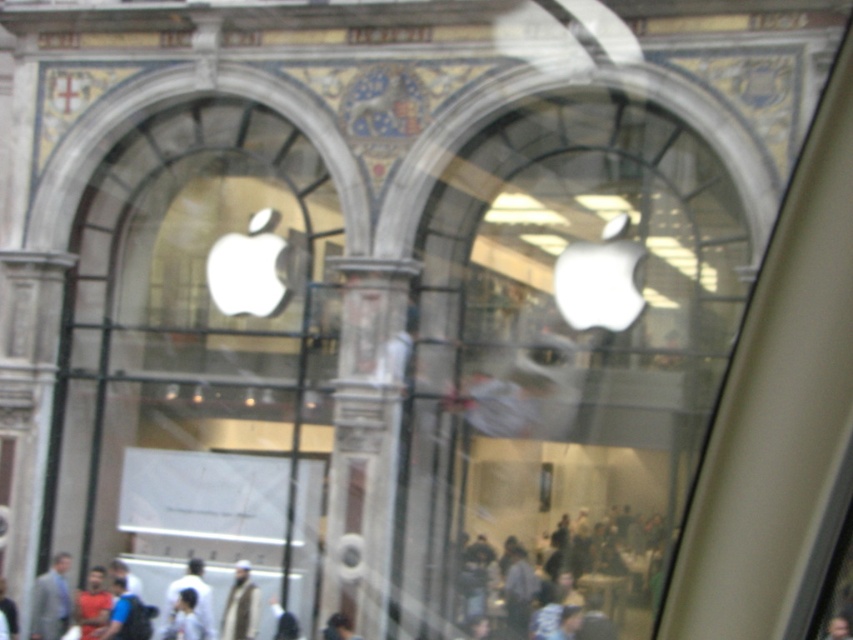
You are standing outside an Apple store and want to take a photo of the white glass apple logo at center. The store has a glass window with classical arches and stone walls. If the logo is 53.57 meters away from you, can you clearly capture it in your photo without zooming?

The white glass apple logo at center is 53.57 meters away from the viewer. Since this distance is quite far, capturing it clearly without zooming may be challenging due to the distance. A zoom lens would likely be necessary to get a clear image.

You are standing in front of the Apple store and want to take a photo of the two points marked on the window. Which point, point (103, 404) or point (252, 604), is closer to your camera lens when taking the photo?

Point (103, 404) is further to the camera than point (252, 604), so the point closer to your camera lens is point (252, 604).